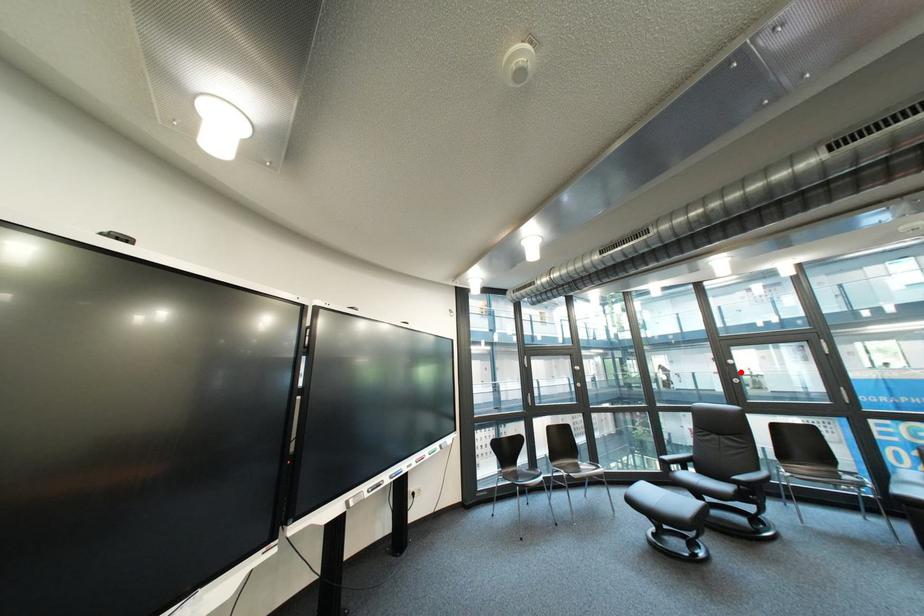
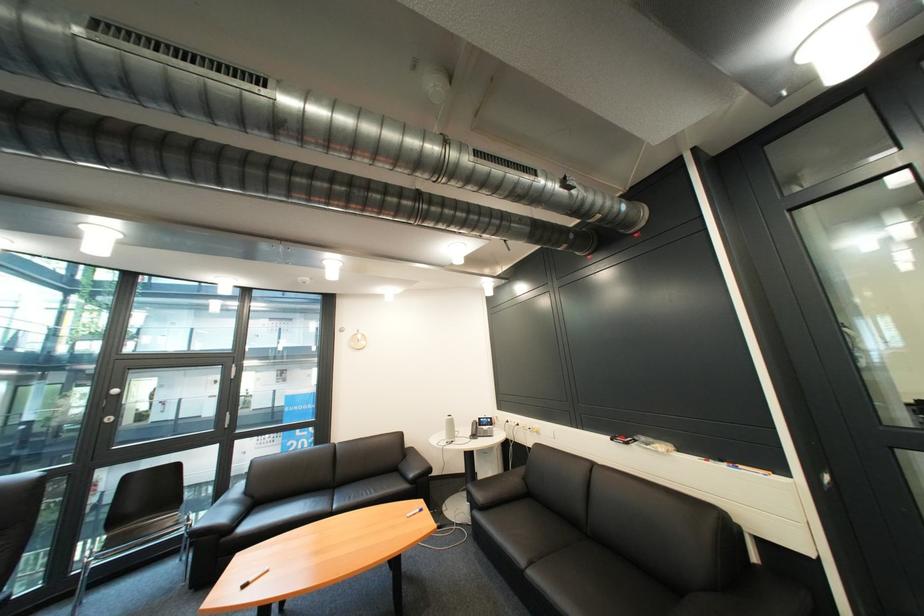
Where in the second image is the point corresponding to the highlighted location from the first image?

(118, 408)